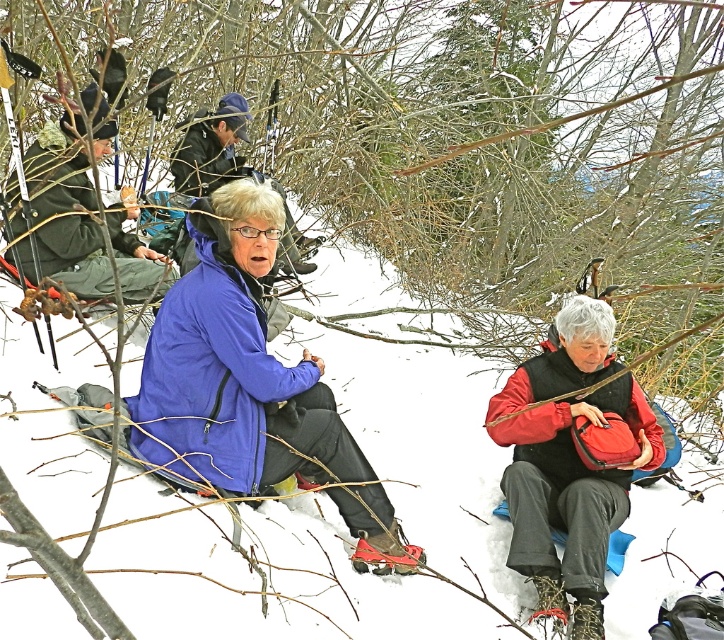
You are a photographer trying to capture both the blue softshell jacket at center and the dark blue jacket at upper center in a single shot. Which jacket should you focus on first to ensure both are in frame?

You should focus on the dark blue jacket at upper center first because the blue softshell jacket at center is in front of it, ensuring both will be visible in the frame.

You are a photographer trying to capture both the dark blue jacket at upper center and the red rubber snowshoe at lower center in a single shot. Which object should you focus on first to ensure both are in clear view?

You should focus on the dark blue jacket at upper center first because it is closer to the viewer than the red rubber snowshoe at lower center, ensuring both will be in focus when focused on the closer object.

You are a photographer trying to capture a photo of the dark blue jacket at upper center and the red rubber snowshoe at lower center. Which object should you focus on first if you want to ensure both are in focus without adjusting the camera settings?

The dark blue jacket at upper center is above the red rubber snowshoe at lower center, so focusing on the dark blue jacket at upper center first will ensure both are in focus since it is closer to the camera.